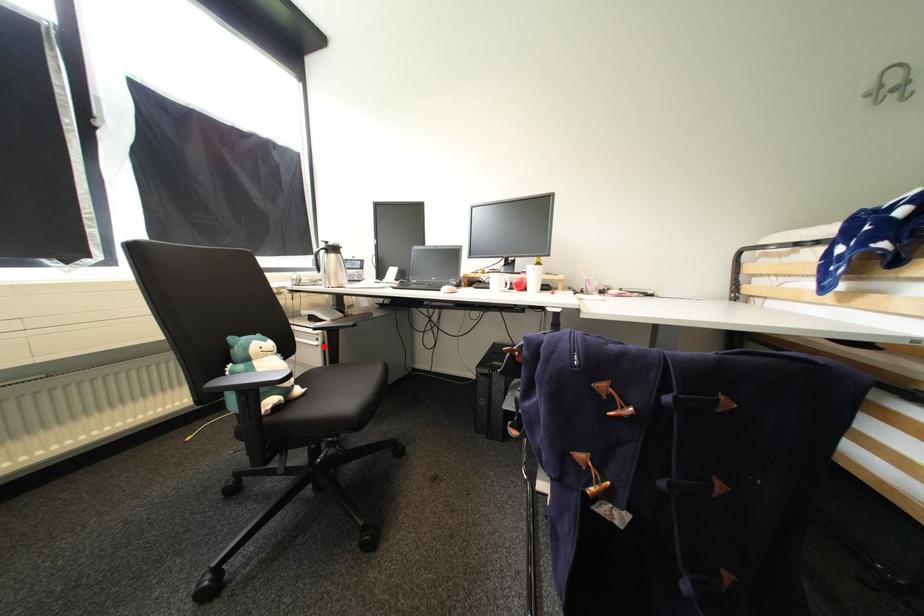
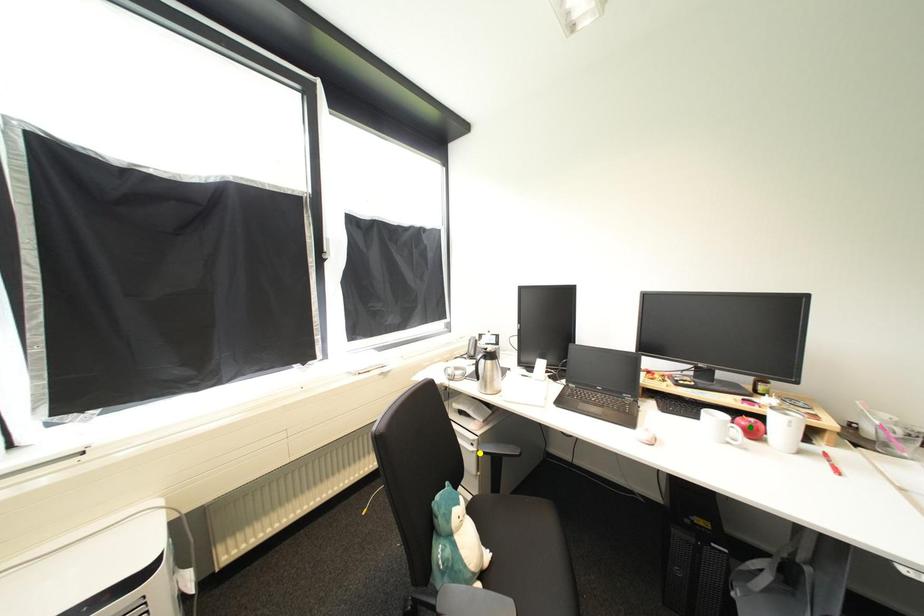
Question: I am providing you with two images of the same scene from different viewpoints. A red point is marked on the first image. You are given multiple points on the second image. Which point in image 2 is actually the same real-world point as the red point in image 1?

Choices:
 (A) yellow point
 (B) blue point
 (C) green point

Answer: (A)